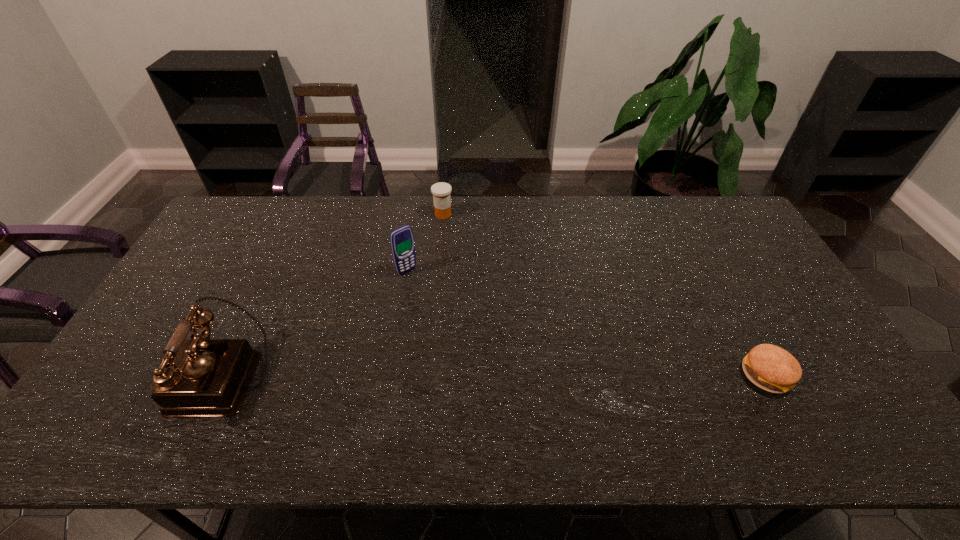
This screenshot has height=540, width=960. Identify the location of hamburger at the near edge. (769, 367).

What are the coordinates of `object positioned at the left edge` in the screenshot? It's located at (199, 377).

At what (x,y) coordinates should I click in order to perform the action: click on object that is at the right edge. Please return your answer as a coordinate pair (x, y). Looking at the image, I should click on (769, 367).

Identify the location of object that is at the near left corner. pos(199,377).

Locate an element on the screen. object present at the near right corner is located at coordinates (769, 367).

In the image, there is a desktop. Identify the location of vacant space at the far edge. The image size is (960, 540). (636, 229).

Identify the location of free space at the near edge of the desktop. (589, 384).

At what (x,y) coordinates should I click in order to perform the action: click on free space at the left edge. Please return your answer as a coordinate pair (x, y). The height and width of the screenshot is (540, 960). Looking at the image, I should click on (220, 267).

At what (x,y) coordinates should I click in order to perform the action: click on free point at the right edge. Please return your answer as a coordinate pair (x, y). The image size is (960, 540). Looking at the image, I should click on (773, 314).

Find the location of a particular element. vacant position at the far right corner of the desktop is located at coordinates (712, 234).